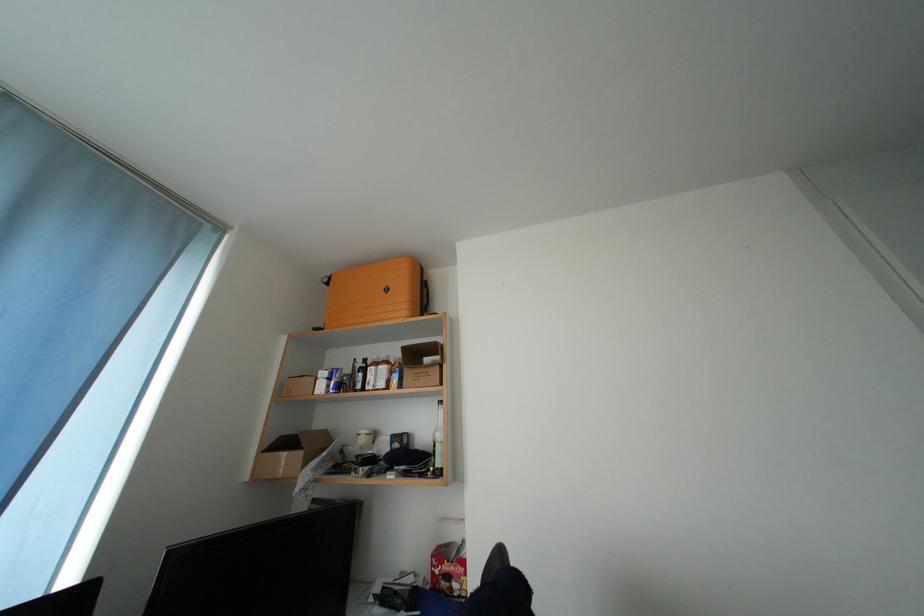
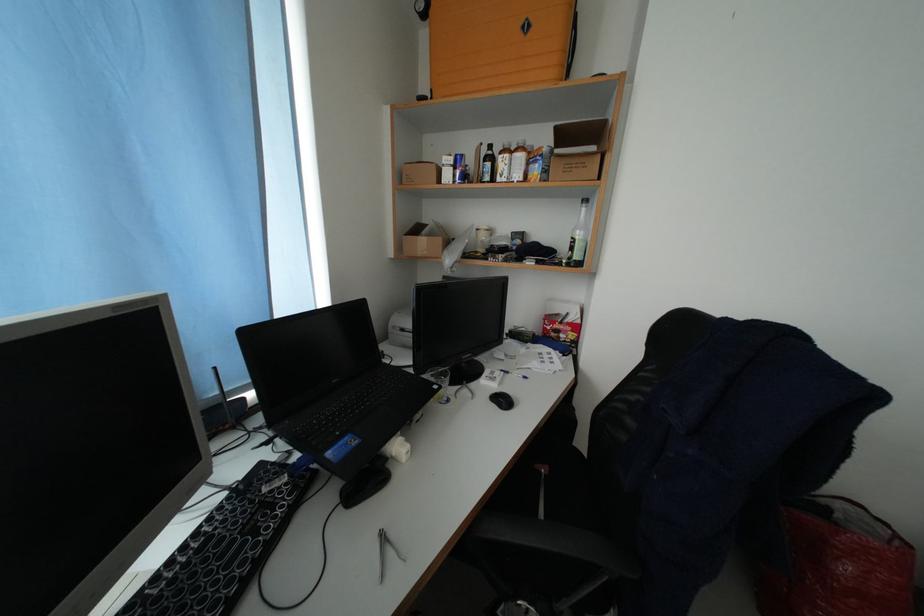
Locate, in the second image, the point that corresponds to point 368,369 in the first image.

(492, 156)